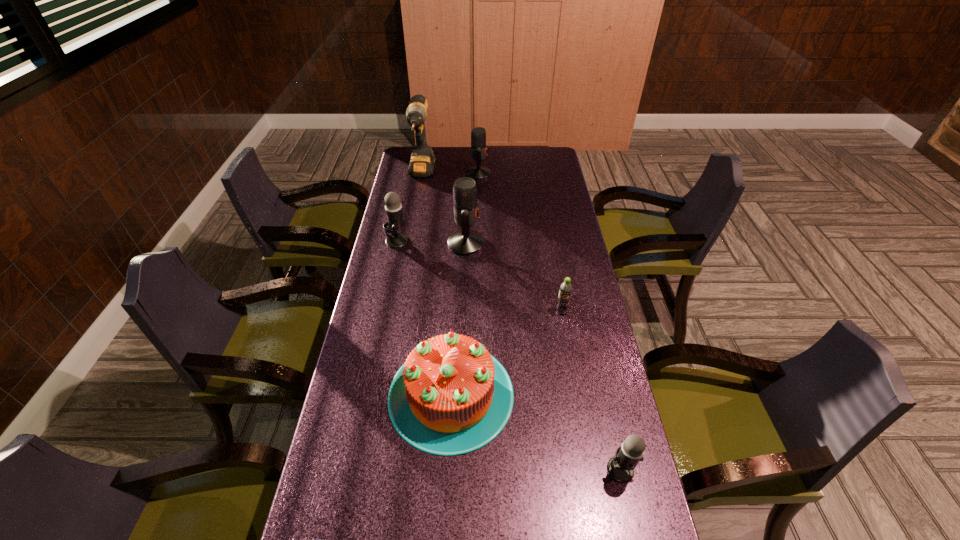
I want to click on vacant space at the far left corner, so click(x=408, y=161).

I want to click on vacant space at the far right corner of the desktop, so click(x=546, y=166).

The width and height of the screenshot is (960, 540). What are the coordinates of `unoccupied position between the drill and the fourth nearest object` in the screenshot? It's located at (492, 242).

Find the location of a particular element. vacant space that is in between the bigger red microphone and the right gray microphone is located at coordinates (543, 356).

The image size is (960, 540). Identify the location of empty space between the drill and the seventh shortest object. (444, 208).

Identify the location of vacant point located between the smaller red microphone and the fourth nearest object. This screenshot has width=960, height=540. (520, 243).

Locate an element on the screen. Image resolution: width=960 pixels, height=540 pixels. vacant space that's between the nearer red microphone and the bigger gray microphone is located at coordinates (431, 242).

The width and height of the screenshot is (960, 540). What are the coordinates of `vacant point located between the nearer red microphone and the left gray microphone` in the screenshot? It's located at (431, 242).

This screenshot has height=540, width=960. In order to click on object that is the third closest to the soda in this screenshot , I will do `click(620, 467)`.

What are the coordinates of `object that can be found as the second closest to the fifth farthest object` in the screenshot? It's located at (465, 242).